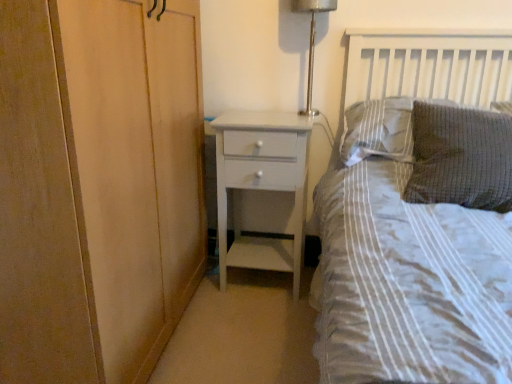
Question: Considering the relative sizes of textured gray pillow at upper right, the second pillow from the back, and white painted wood chest of drawers at center in the image provided, is textured gray pillow at upper right, the second pillow from the back, bigger than white painted wood chest of drawers at center?

Choices:
 (A) no
 (B) yes

Answer: (A)

Question: Is textured gray pillow at upper right, the second pillow from the back, not close to white painted wood chest of drawers at center?

Choices:
 (A) no
 (B) yes

Answer: (A)

Question: Considering the relative sizes of textured gray pillow at upper right, the second pillow from the back, and white painted wood chest of drawers at center in the image provided, is textured gray pillow at upper right, the second pillow from the back, taller than white painted wood chest of drawers at center?

Choices:
 (A) no
 (B) yes

Answer: (A)

Question: Is textured gray pillow at upper right, the second pillow from the back, shorter than white painted wood chest of drawers at center?

Choices:
 (A) no
 (B) yes

Answer: (B)

Question: Is textured gray pillow at upper right, which is the first pillow in front-to-back order, outside of white painted wood chest of drawers at center?

Choices:
 (A) yes
 (B) no

Answer: (A)

Question: Is gray textured pillow at upper right, which is the first pillow from back to front, taller or shorter than textured gray pillow at upper right, which is the first pillow in front-to-back order?

Choices:
 (A) short
 (B) tall

Answer: (A)

Question: Considering the positions of gray textured pillow at upper right, which is the first pillow from back to front, and textured gray pillow at upper right, which is the first pillow in front-to-back order, in the image, is gray textured pillow at upper right, which is the first pillow from back to front, bigger or smaller than textured gray pillow at upper right, which is the first pillow in front-to-back order,?

Choices:
 (A) big
 (B) small

Answer: (A)

Question: From the image's perspective, is gray textured pillow at upper right, which is the first pillow from back to front, positioned above or below textured gray pillow at upper right, the second pillow from the back?

Choices:
 (A) above
 (B) below

Answer: (A)

Question: From a real-world perspective, is gray textured pillow at upper right, which is the first pillow from back to front, positioned above or below textured gray pillow at upper right, which is the first pillow in front-to-back order?

Choices:
 (A) below
 (B) above

Answer: (B)

Question: In the image, is white painted wood chest of drawers at center on the left side or the right side of textured gray pillow at upper right, which is the first pillow in front-to-back order?

Choices:
 (A) right
 (B) left

Answer: (B)

Question: Is white painted wood chest of drawers at center taller or shorter than textured gray pillow at upper right, which is the first pillow in front-to-back order?

Choices:
 (A) short
 (B) tall

Answer: (B)

Question: Considering the positions of point (243, 119) and point (413, 168), is point (243, 119) closer or farther from the camera than point (413, 168)?

Choices:
 (A) farther
 (B) closer

Answer: (A)

Question: Would you say white painted wood chest of drawers at center is inside or outside textured gray pillow at upper right, which is the first pillow in front-to-back order?

Choices:
 (A) inside
 (B) outside

Answer: (B)

Question: Based on their positions, is gray textured pillow at upper right, which is the first pillow from back to front, located to the left or right of metallic silver lamp at upper right?

Choices:
 (A) right
 (B) left

Answer: (A)

Question: Considering the positions of gray textured pillow at upper right, which is the first pillow from back to front, and metallic silver lamp at upper right in the image, is gray textured pillow at upper right, which is the first pillow from back to front, wider or thinner than metallic silver lamp at upper right?

Choices:
 (A) wide
 (B) thin

Answer: (A)